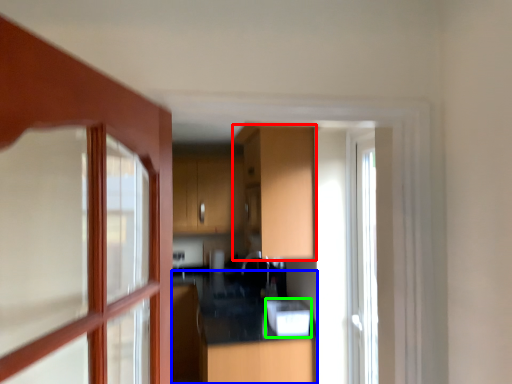
Question: Which is farther away from cabinetry (highlighted by a red box)? counter top (highlighted by a blue box) or appliance (highlighted by a green box)?

Choices:
 (A) counter top
 (B) appliance

Answer: (A)